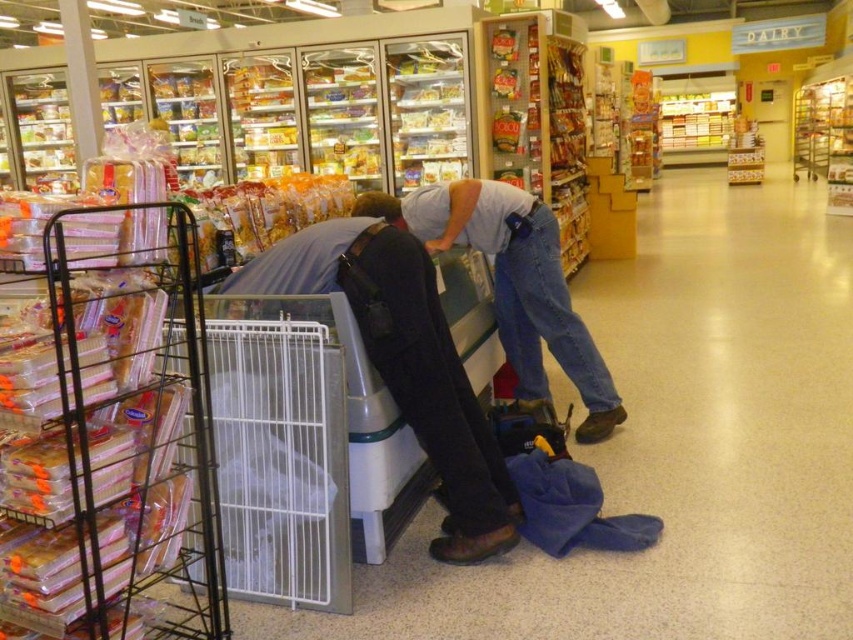
You are a store employee who needs to restock the refrigerated section. You have a box of new items to place on the shelf. The dark gray fabric at lower center and denim jeans at center are blocking the space where you need to put the items. Which object should you move first to access the area behind them?

You should move the dark gray fabric at lower center first because it is located below the denim jeans at center, so moving it first will allow access to the area behind both objects.

You are a store employee who needs to place a new sign on the refrigerator. The sign requires a hook that can be attached to either the dark gray fabric at lower center or the denim jeans at center. Which item is shorter and thus more suitable for placing the hook lower down?

The dark gray fabric at lower center is shorter than the denim jeans at center, so it would be more suitable for placing the hook lower down.